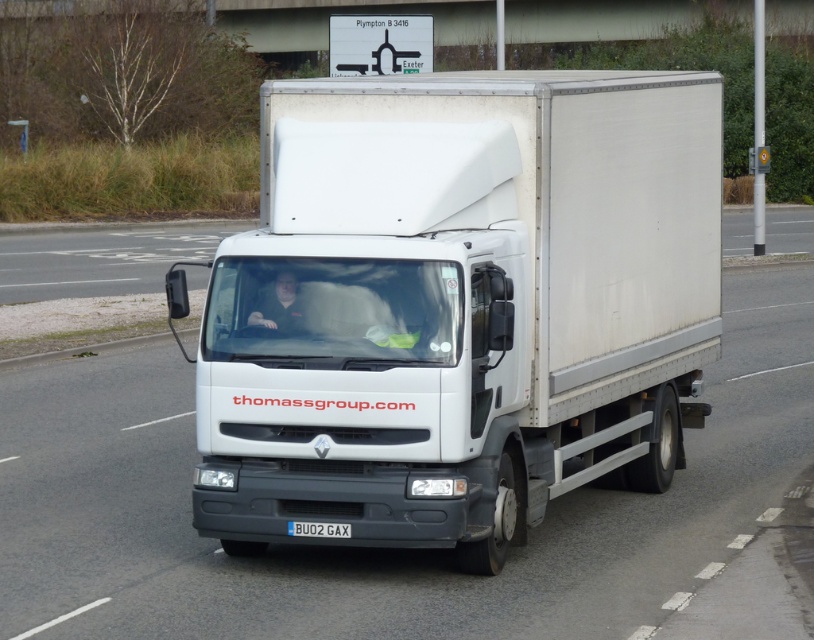
You are a traffic officer observing the road. You notice two trucks, a white matte truck at center and a white glossy truck at center. Which truck takes up less space on the road?

The white matte truck at center has a lesser width compared to the white glossy truck at center, so it takes up less space on the road.

You are a traffic monitoring system analyzing the scene. The white glossy truck at center is detected at coordinates. What are its coordinates?

The white glossy truck at center is located at coordinates point (377, 548).